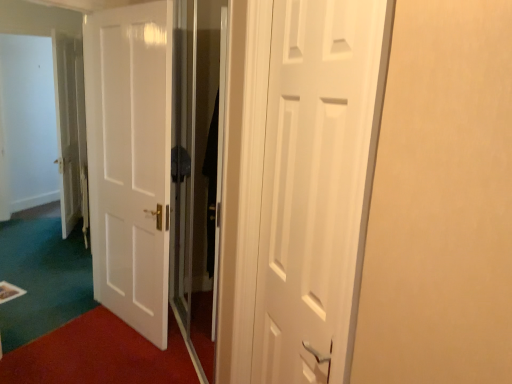
Question: Can you confirm if white glossy door at center, positioned as the 2th door in front-to-back order, is wider than transparent glass screen door at center?

Choices:
 (A) no
 (B) yes

Answer: (B)

Question: Considering the relative sizes of white glossy door at center, which appears as the first door when viewed from the back, and transparent glass screen door at center in the image provided, is white glossy door at center, which appears as the first door when viewed from the back, taller than transparent glass screen door at center?

Choices:
 (A) yes
 (B) no

Answer: (B)

Question: Can you confirm if white glossy door at center, the 2th door positioned from the right, is bigger than transparent glass screen door at center?

Choices:
 (A) yes
 (B) no

Answer: (B)

Question: Would you say white glossy door at center, marked as the 1th door in a left-to-right arrangement, is outside transparent glass screen door at center?

Choices:
 (A) yes
 (B) no

Answer: (A)

Question: Considering the relative sizes of white glossy door at center, which appears as the first door when viewed from the back, and transparent glass screen door at center in the image provided, is white glossy door at center, which appears as the first door when viewed from the back, thinner than transparent glass screen door at center?

Choices:
 (A) no
 (B) yes

Answer: (A)

Question: Is white glossy door at center, positioned as the 2th door in front-to-back order, to the right of transparent glass screen door at center from the viewer's perspective?

Choices:
 (A) no
 (B) yes

Answer: (A)

Question: Does transparent glass screen door at center come behind white glossy door at center, positioned as the 2th door in front-to-back order?

Choices:
 (A) no
 (B) yes

Answer: (A)

Question: Is the depth of transparent glass screen door at center less than that of white glossy door at center, positioned as the 2th door in front-to-back order?

Choices:
 (A) yes
 (B) no

Answer: (A)

Question: Considering the relative sizes of transparent glass screen door at center and white glossy door at center, the 2th door positioned from the right, in the image provided, is transparent glass screen door at center wider than white glossy door at center, the 2th door positioned from the right,?

Choices:
 (A) yes
 (B) no

Answer: (B)

Question: Is transparent glass screen door at center not close to white glossy door at center, positioned as the 2th door in front-to-back order?

Choices:
 (A) yes
 (B) no

Answer: (B)

Question: Is white glossy door at center, marked as the 1th door in a left-to-right arrangement, located within transparent glass screen door at center?

Choices:
 (A) yes
 (B) no

Answer: (B)

Question: Is transparent glass screen door at center to the left of white glossy door at center, marked as the 1th door in a left-to-right arrangement, from the viewer's perspective?

Choices:
 (A) no
 (B) yes

Answer: (A)

Question: Could you tell me if white glossy door at center, marked as the 1th door in a left-to-right arrangement, is facing white matte door at center, the 2th door viewed from the left?

Choices:
 (A) yes
 (B) no

Answer: (B)